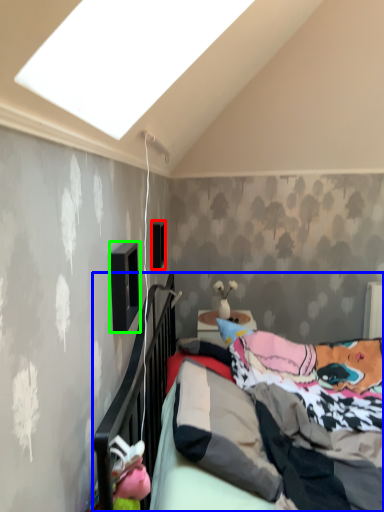
Question: Considering the real-world distances, which object is farthest from window (highlighted by a red box)? bed (highlighted by a blue box) or window (highlighted by a green box)?

Choices:
 (A) bed
 (B) window

Answer: (B)